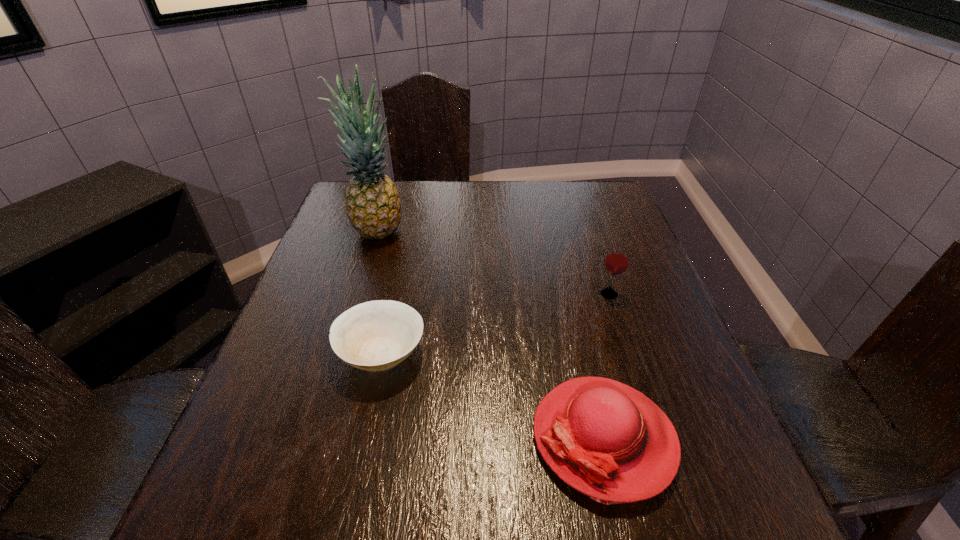
Find the location of a particular element. The image size is (960, 540). unoccupied position between the glass and the tallest object is located at coordinates click(492, 262).

Find the location of a particular element. The image size is (960, 540). free area in between the bowl and the second farthest object is located at coordinates (495, 323).

Locate an element on the screen. This screenshot has width=960, height=540. vacant area that lies between the third tallest object and the shortest object is located at coordinates (492, 395).

Find the location of a particular element. free space between the bowl and the second shortest object is located at coordinates (492, 395).

Locate which object is the closest to the glass. Please provide its 2D coordinates. Your answer should be formatted as a tuple, i.e. [(x, y)], where the tuple contains the x and y coordinates of a point satisfying the conditions above.

[(607, 440)]

Identify which object is located as the nearest to the second tallest object. Please provide its 2D coordinates. Your answer should be formatted as a tuple, i.e. [(x, y)], where the tuple contains the x and y coordinates of a point satisfying the conditions above.

[(607, 440)]